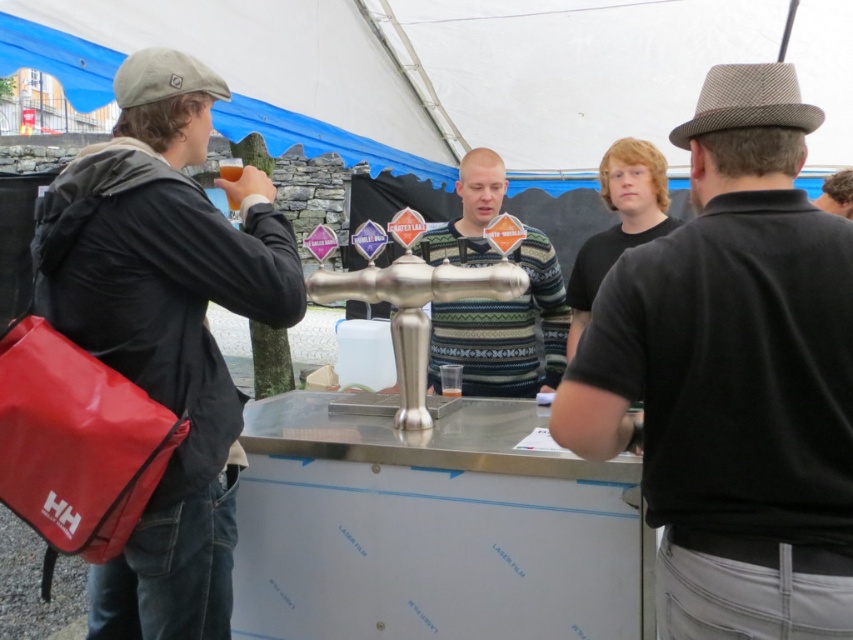
Can you confirm if black textured shirt at right is positioned to the right of striped sweater at center?

Indeed, black textured shirt at right is positioned on the right side of striped sweater at center.

Is black textured shirt at right above striped sweater at center?

Actually, black textured shirt at right is below striped sweater at center.

Is point (807, 257) less distant than point (447, 349)?

Yes, point (807, 257) is in front of point (447, 349).

At what (x,y) coordinates should I click in order to perform the action: click on black textured shirt at right. Please return your answer as a coordinate pair (x, y). Looking at the image, I should click on (733, 378).

Does black textured shirt at right appear under smooth brown hair at upper right?

Yes, black textured shirt at right is below smooth brown hair at upper right.

Between point (773, 616) and point (846, 193), which one is positioned behind?

The point (846, 193) is more distant.

This screenshot has width=853, height=640. I want to click on black textured shirt at right, so click(x=733, y=378).

Between black textured shirt at right and matte black jacket at left, which one appears on the right side from the viewer's perspective?

Positioned to the right is black textured shirt at right.

Between point (788, 513) and point (62, 204), which one is positioned in front?

Point (788, 513) is more forward.

Does point (825, 364) lie behind point (141, 310)?

No, it is in front of (141, 310).

This screenshot has height=640, width=853. In order to click on black textured shirt at right in this screenshot , I will do `click(733, 378)`.